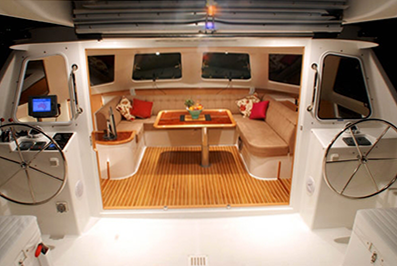
The width and height of the screenshot is (397, 266). I want to click on screen, so click(x=41, y=106).